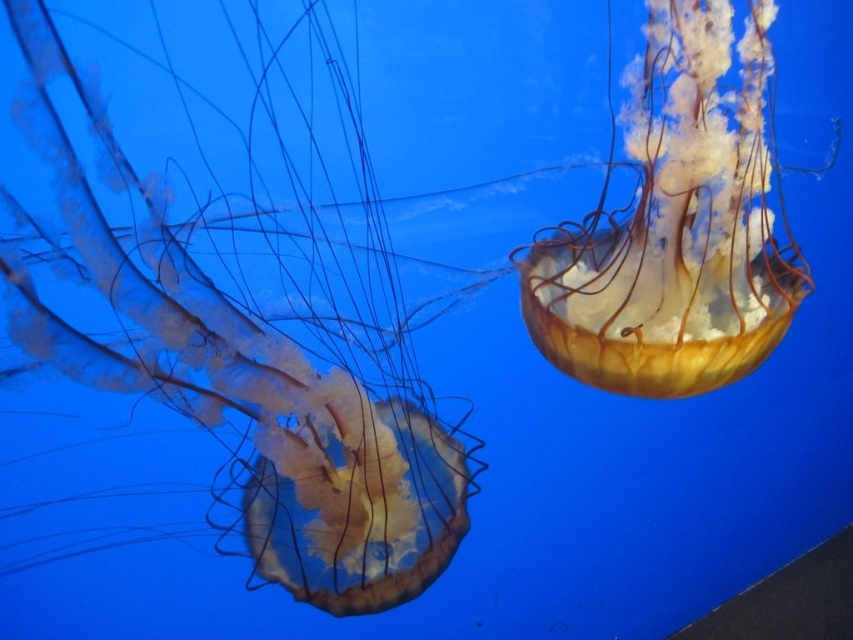
You are an aquarium visitor observing two jellyfish in the tank. You see the translucent gelatinous at left and the translucent yellowish jellyfish at upper right. Which one is located to the left of the other?

The translucent gelatinous at left is positioned on the left side of the translucent yellowish jellyfish at upper right.

You are an aquarium guide explaining the jellyfish to a visitor. You mention that the translucent gelatinous at left and the translucent yellowish jellyfish at upper right are different sizes. Which one is bigger?

The translucent gelatinous at left is larger in size compared to the translucent yellowish jellyfish at upper right.